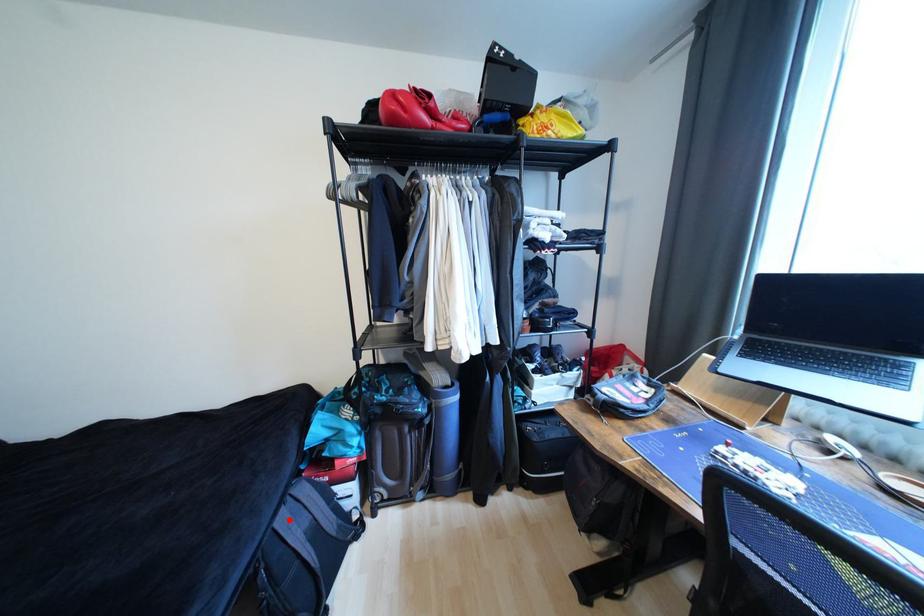
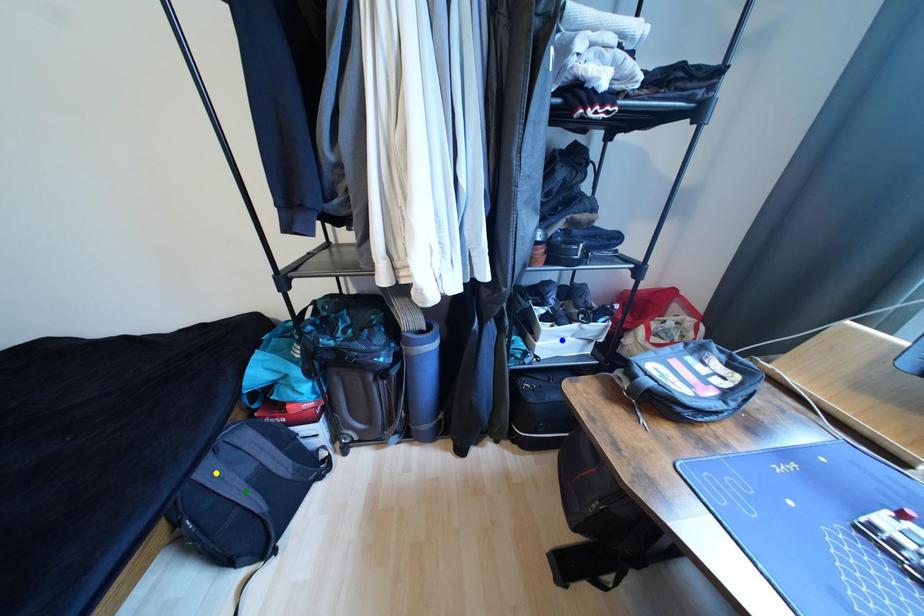
Question: I am providing you with two images of the same scene from different viewpoints. A red point is marked on the first image. You are given multiple points on the second image. Which mark in image 2 goes with the point in image 1?

Choices:
 (A) green point
 (B) blue point
 (C) yellow point

Answer: (C)